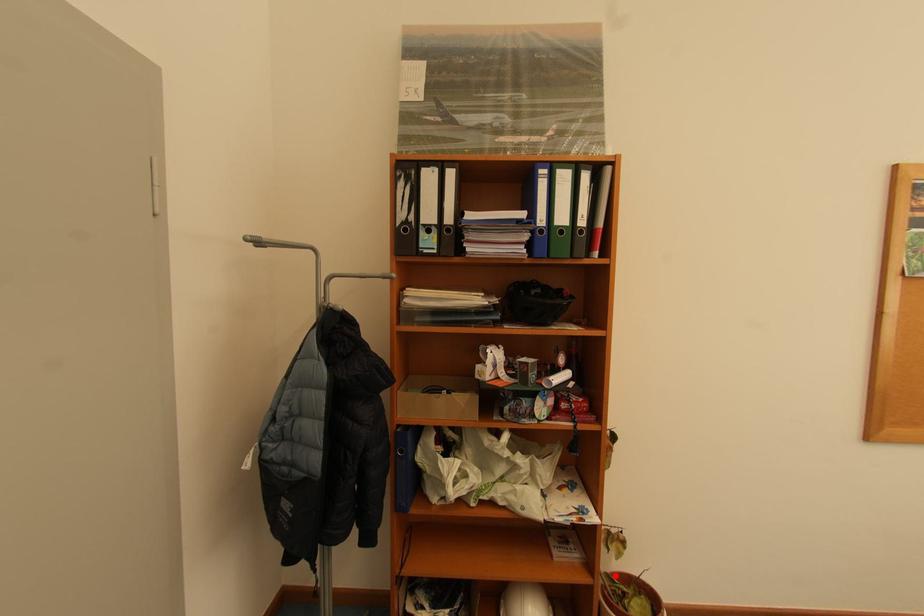
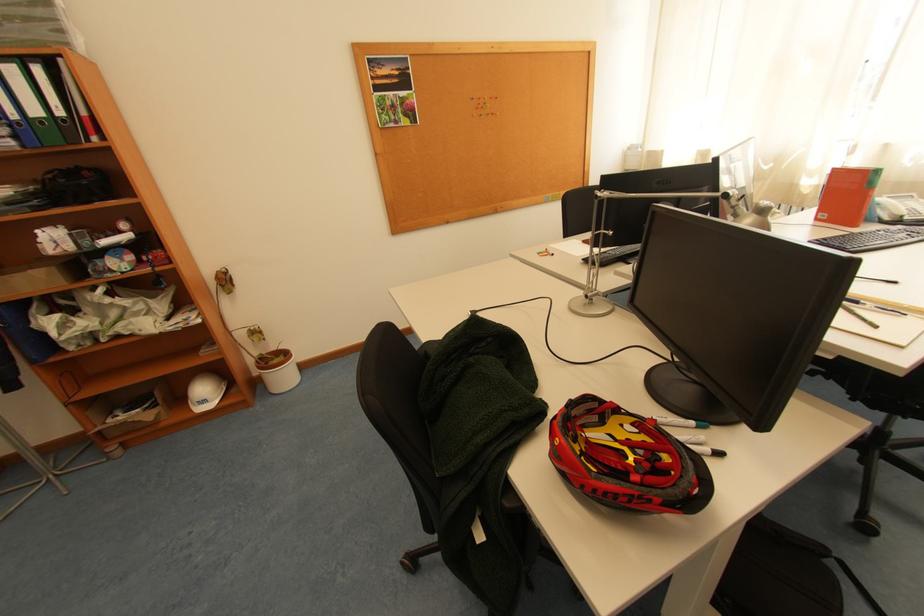
In the second image, find the point that corresponds to the highlighted location in the first image.

(270, 355)